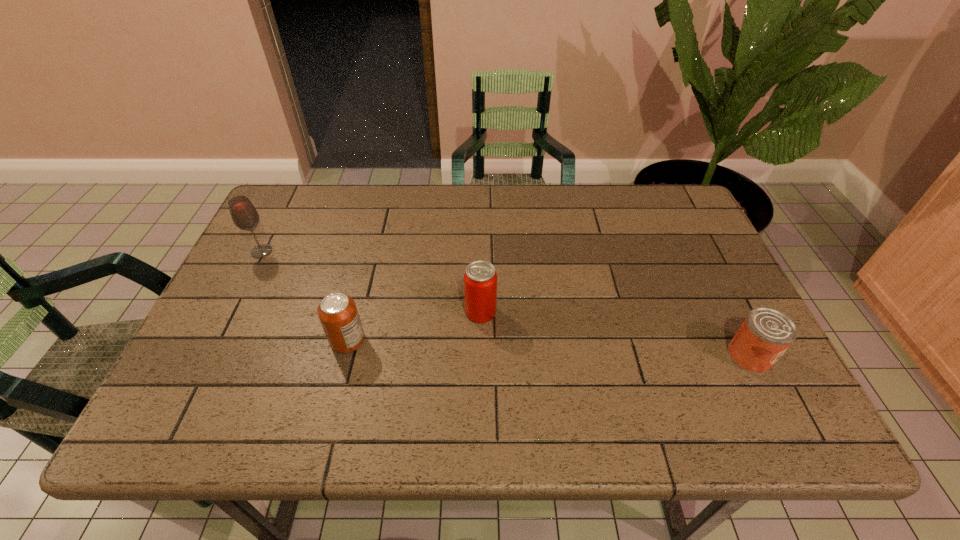
Identify the location of free location located on the back of the shortest can. (713, 285).

At what (x,y) coordinates should I click in order to perform the action: click on object that is positioned at the left edge. Please return your answer as a coordinate pair (x, y). Image resolution: width=960 pixels, height=540 pixels. Looking at the image, I should click on pos(243,213).

Locate an element on the screen. The width and height of the screenshot is (960, 540). object located at the right edge is located at coordinates (766, 333).

Find the location of `vacant space at the far edge of the desktop`. vacant space at the far edge of the desktop is located at coordinates (539, 185).

The image size is (960, 540). What are the coordinates of `free point at the near edge` in the screenshot? It's located at (559, 437).

In the image, there is a desktop. Identify the location of free space at the left edge. Image resolution: width=960 pixels, height=540 pixels. (226, 356).

Locate an element on the screen. free space at the right edge of the desktop is located at coordinates (729, 385).

In order to click on blank space at the far left corner of the desktop in this screenshot , I will do `click(322, 206)`.

In the image, there is a desktop. Identify the location of vacant space at the near left corner. (162, 423).

The width and height of the screenshot is (960, 540). Identify the location of vacant space at the far right corner of the desktop. (685, 206).